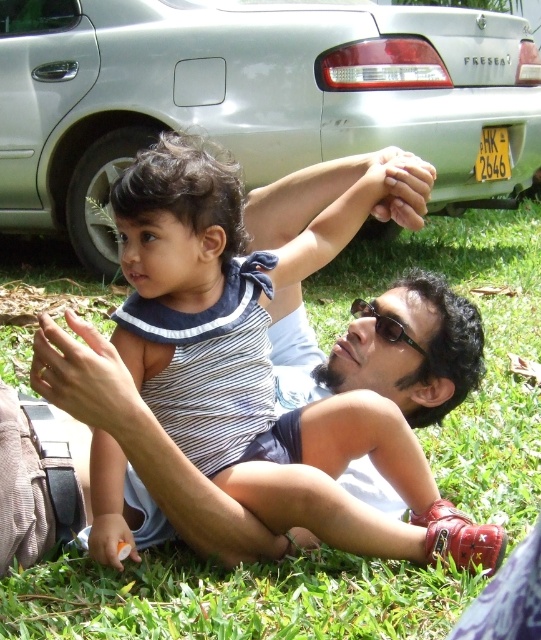
Which of these two, silver metallic car at upper center or green grass at center, stands shorter?

With less height is green grass at center.

Is silver metallic car at upper center further to the viewer compared to green grass at center?

Yes, silver metallic car at upper center is behind green grass at center.

Is point (452, 29) behind point (312, 275)?

Yes, point (452, 29) is behind point (312, 275).

This screenshot has width=541, height=640. In order to click on silver metallic car at upper center in this screenshot , I will do `click(254, 97)`.